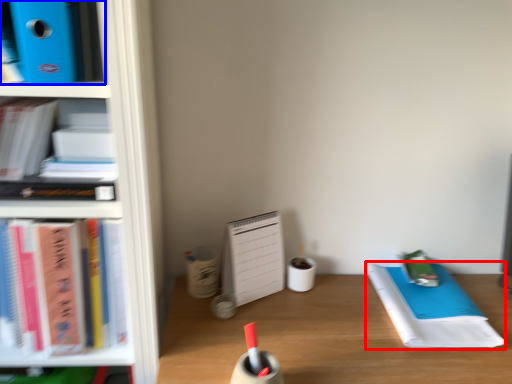
Question: Which object is further to the camera taking this photo, notebook (highlighted by a red box) or book (highlighted by a blue box)?

Choices:
 (A) notebook
 (B) book

Answer: (A)